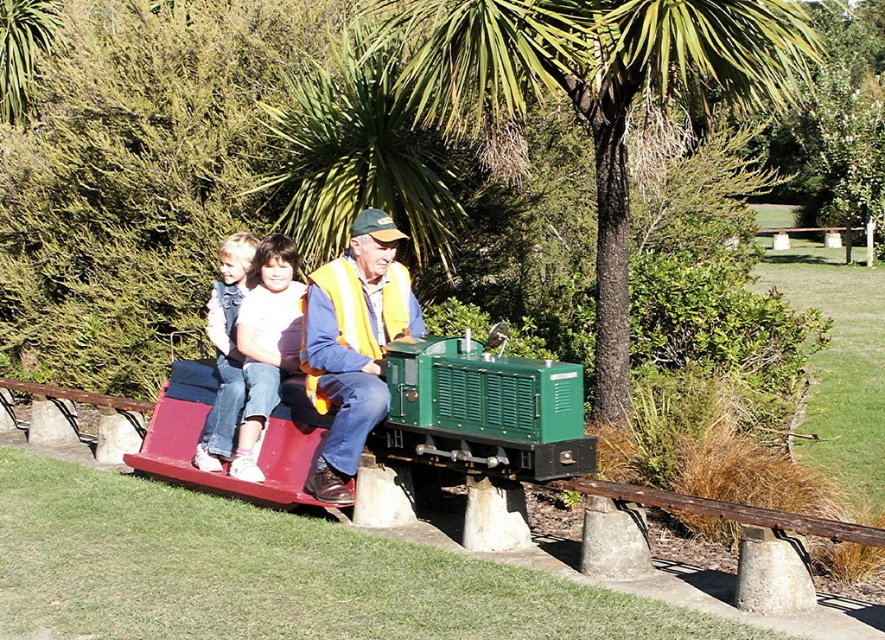
Question: Which object is farther from the camera taking this photo?

Choices:
 (A) denim jeans at left
 (B) green matte train at center

Answer: (A)

Question: Does green leafy palm tree at center have a smaller size compared to white cotton shirt at center?

Choices:
 (A) no
 (B) yes

Answer: (A)

Question: Estimate the real-world distances between objects in this image. Which object is closer to the yellow reflective vest at center?

Choices:
 (A) green matte train at center
 (B) white cotton shirt at center
 (C) denim jeans at left
 (D) green leafy palm tree at center

Answer: (A)

Question: Which is nearer to the white cotton shirt at center?

Choices:
 (A) green leafy palm tree at center
 (B) yellow reflective vest at center
 (C) denim jeans at left
 (D) green matte train at center

Answer: (C)

Question: Can you confirm if white cotton shirt at center is thinner than denim jeans at left?

Choices:
 (A) yes
 (B) no

Answer: (B)

Question: Where is green leafy palm tree at center located in relation to yellow reflective vest at center in the image?

Choices:
 (A) above
 (B) below

Answer: (A)